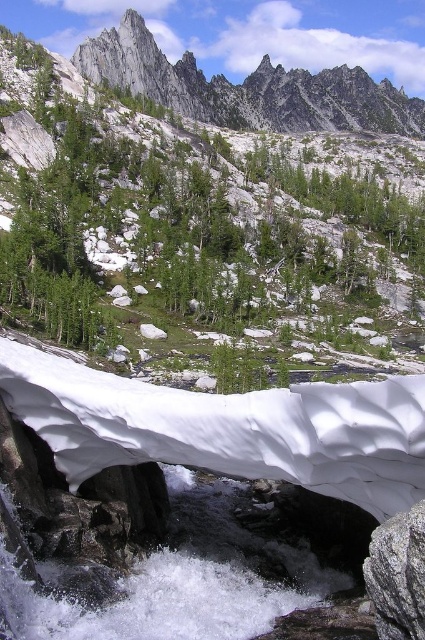
Question: Which point is closer to the camera taking this photo?

Choices:
 (A) (x=413, y=532)
 (B) (x=138, y=45)
 (C) (x=390, y=266)

Answer: (A)

Question: Observing the image, what is the correct spatial positioning of green leafy hillside at upper center in reference to gray rough rock at lower right?

Choices:
 (A) right
 (B) left

Answer: (B)

Question: Which object is closer to the camera taking this photo?

Choices:
 (A) gray rough rock at lower right
 (B) green leafy hillside at upper center

Answer: (A)

Question: Is rugged granite peaks at upper center bigger than gray rough rock at lower right?

Choices:
 (A) yes
 (B) no

Answer: (A)

Question: Is green leafy hillside at upper center to the right of rugged granite peaks at upper center from the viewer's perspective?

Choices:
 (A) yes
 (B) no

Answer: (B)

Question: Which object appears farthest from the camera in this image?

Choices:
 (A) green leafy hillside at upper center
 (B) gray rough rock at lower right
 (C) rugged granite peaks at upper center

Answer: (C)